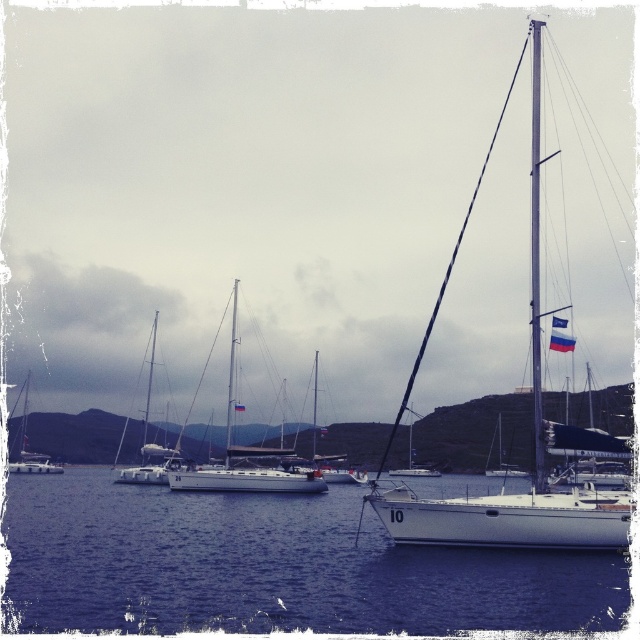
Question: Which object appears closest to the camera in this image?

Choices:
 (A) blue water at center
 (B) white glossy sailboat at right
 (C) white matte sailboat at left
 (D) white matte sailboat at center

Answer: (A)

Question: Can you confirm if silver/metallic mast at upper right is smaller than white matte sailboat at center?

Choices:
 (A) yes
 (B) no

Answer: (B)

Question: Is silver/metallic mast at upper right in front of white glossy sailboat at left?

Choices:
 (A) no
 (B) yes

Answer: (B)

Question: Is silver/metallic mast at upper right smaller than white matte sailboat at center?

Choices:
 (A) no
 (B) yes

Answer: (A)

Question: Estimate the real-world distances between objects in this image. Which object is closer to the silver/metallic mast at upper right?

Choices:
 (A) white glossy sailboat at right
 (B) blue water at center

Answer: (A)

Question: Among these objects, which one is nearest to the camera?

Choices:
 (A) white glossy sailboat at right
 (B) white matte sailboat at center

Answer: (A)